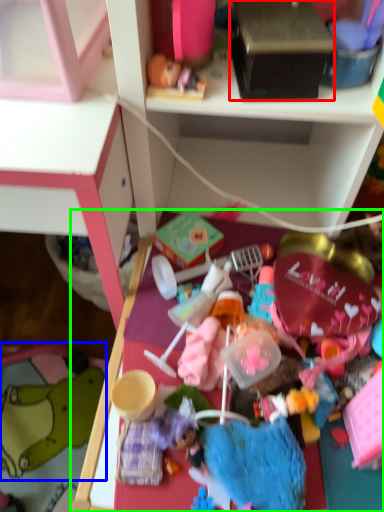
Question: Which object is positioned farthest from box (highlighted by a red box)? Select from toy (highlighted by a blue box) and table (highlighted by a green box).

Choices:
 (A) toy
 (B) table

Answer: (A)